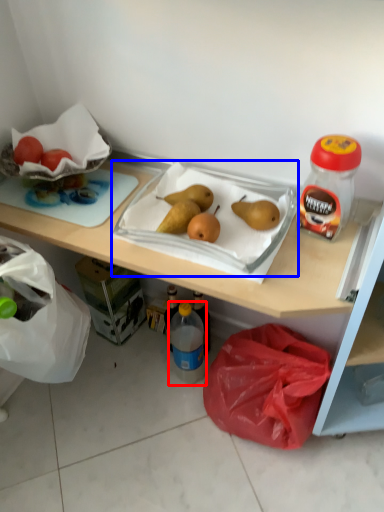
Question: Which of the following is the farthest to the observer, bottle (highlighted by a red box) or wide (highlighted by a blue box)?

Choices:
 (A) bottle
 (B) wide

Answer: (A)